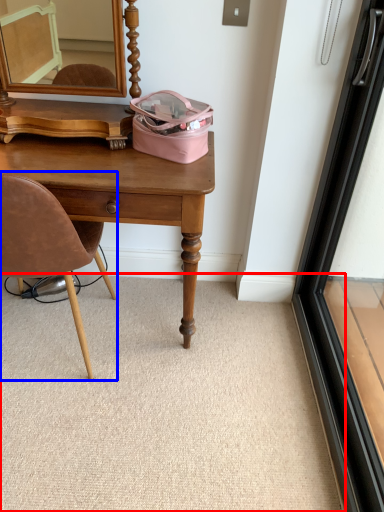
Question: Among these objects, which one is farthest to the camera, plain (highlighted by a red box) or chair (highlighted by a blue box)?

Choices:
 (A) plain
 (B) chair

Answer: (A)